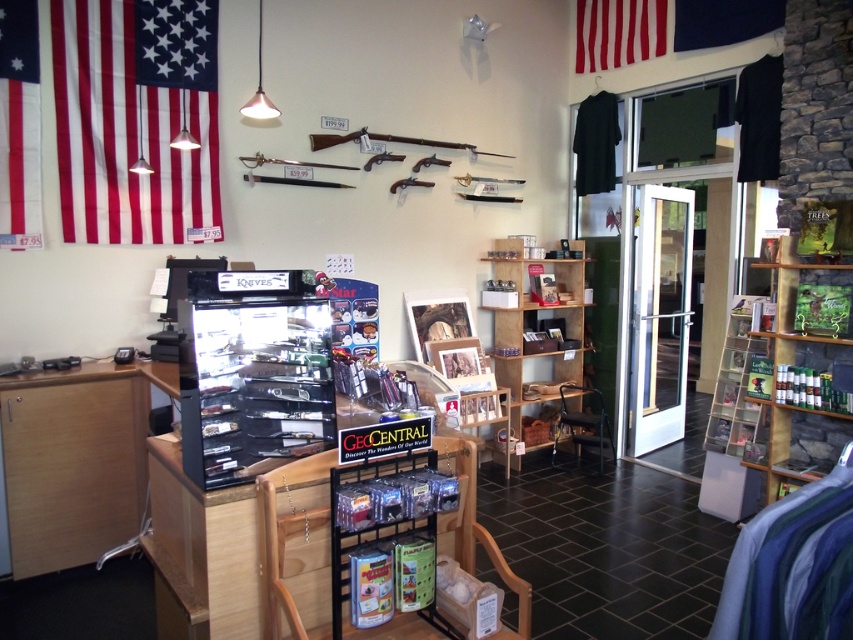
In the scene shown: You are a customer in the store and want to find the knives displayed in the showcase. The showcase is located near the checkout counter. After finding the knives, you need to proceed to the checkout counter. Which direction should you walk relative to the wooden shelves at center and the red fabric flag at upper center?

The wooden shelves at center are to the left of the red fabric flag at upper center. Since the checkout counter is near the knives display case, which is at the left side with the counter, you should walk towards the left side of the wooden shelves at center to reach the checkout counter.

You are a customer standing at the checkout counter in the retail store. You notice two flags hanging above the counter. Which flag is taller between the red fabric flag at upper center and the blue fabric flag at upper center?

The red fabric flag at upper center is much taller than the blue fabric flag at upper center.